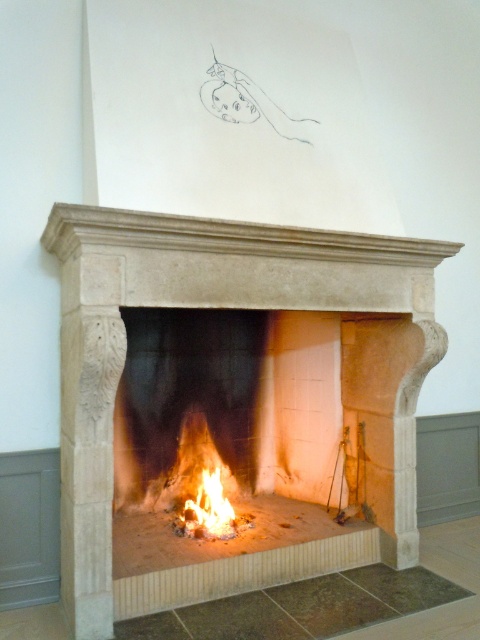
Question: Does flaming wood at center appear under flameflame at center?

Choices:
 (A) yes
 (B) no

Answer: (B)

Question: Can you confirm if beige stone fireplace at center is positioned below flaming wood at center?

Choices:
 (A) yes
 (B) no

Answer: (B)

Question: Which object appears farthest from the camera in this image?

Choices:
 (A) flaming wood at center
 (B) beige stone fireplace at center

Answer: (A)

Question: Which object appears farthest from the camera in this image?

Choices:
 (A) flameflame at center
 (B) flaming wood at center
 (C) beige stone fireplace at center

Answer: (B)

Question: Is flaming wood at center behind flameflame at center?

Choices:
 (A) yes
 (B) no

Answer: (A)

Question: Considering the real-world distances, which object is closest to the flameflame at center?

Choices:
 (A) beige stone fireplace at center
 (B) flaming wood at center

Answer: (B)